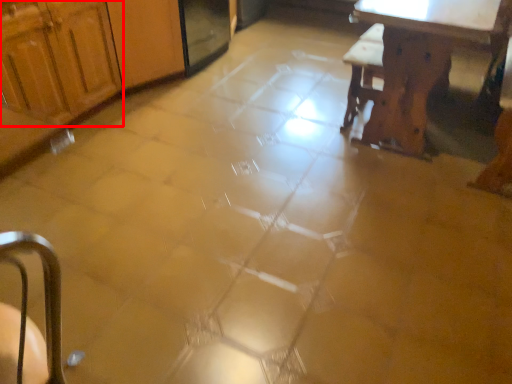
Question: From the image's perspective, what is the correct spatial relationship of cabinetry (annotated by the red box) in relation to table?

Choices:
 (A) below
 (B) above

Answer: (B)